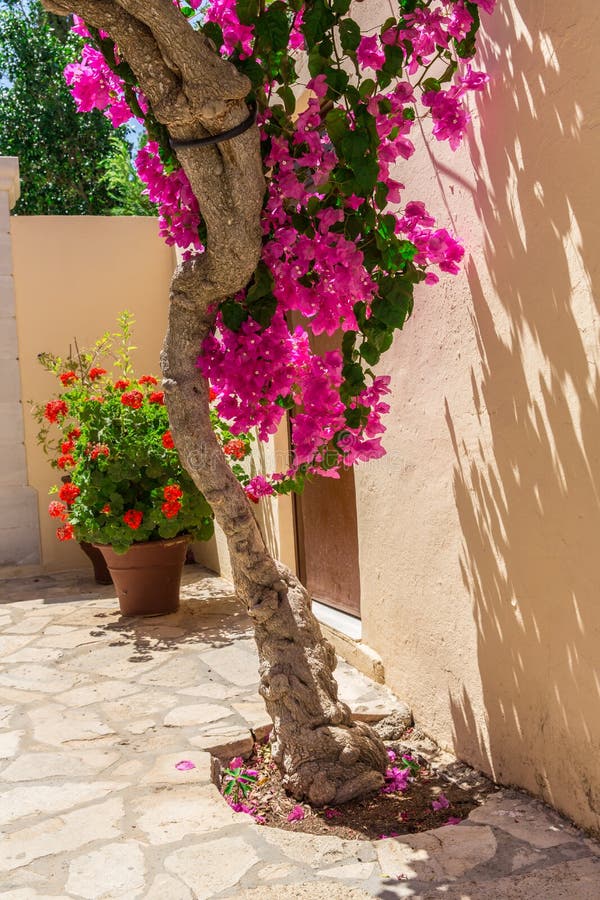
This screenshot has width=600, height=900. I want to click on pot, so click(134, 577).